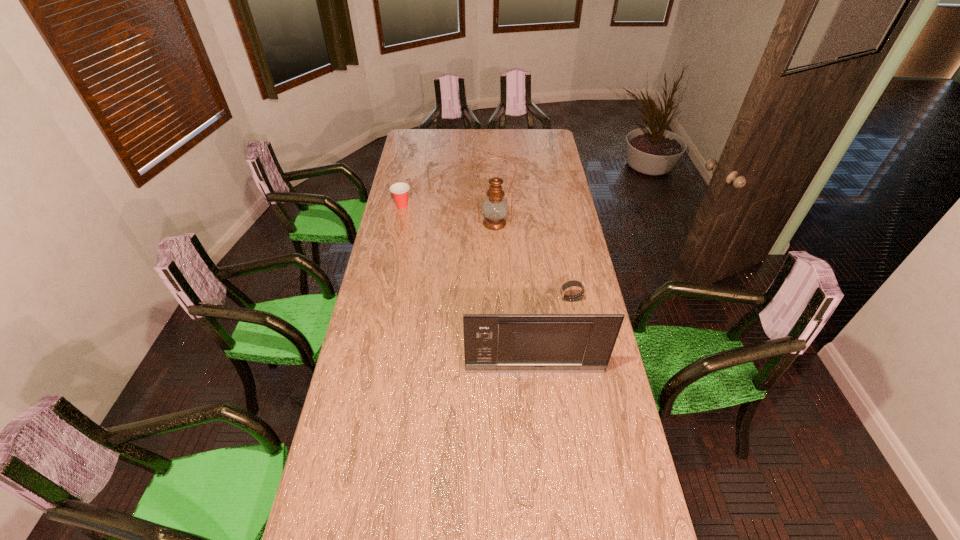
You are a GUI agent. You are given a task and a screenshot of the screen. Output one action in this format:
    pyautogui.click(x=<x>, y=<y>)
    Task: Click on the oil lamp
    Image resolution: width=960 pixels, height=540 pixels.
    Given the screenshot: What is the action you would take?
    pyautogui.click(x=494, y=208)

The height and width of the screenshot is (540, 960). Identify the location of the second tallest object. (493, 343).

This screenshot has width=960, height=540. Find the location of `microwave oven`. microwave oven is located at coordinates (493, 343).

Where is `the farthest object`? This screenshot has height=540, width=960. the farthest object is located at coordinates (399, 190).

Locate an element on the screen. This screenshot has width=960, height=540. the leftmost object is located at coordinates (399, 190).

Image resolution: width=960 pixels, height=540 pixels. Identify the location of the third farthest object. (572, 283).

You are a GUI agent. You are given a task and a screenshot of the screen. Output one action in this format:
    pyautogui.click(x=<x>, y=<y>)
    Task: Click on the free spot located 0.070m on the front of the oil lamp
    The width and height of the screenshot is (960, 540).
    Given the screenshot: What is the action you would take?
    pyautogui.click(x=495, y=241)

At what (x,y) coordinates should I click in order to perform the action: click on free point located 0.090m on the front panel of the nearest object. Please return your answer as a coordinate pair (x, y). The height and width of the screenshot is (540, 960). Looking at the image, I should click on (538, 396).

This screenshot has height=540, width=960. What are the coordinates of `free spot located 0.300m on the right of the farthest object` in the screenshot? It's located at (470, 205).

I want to click on free space located on the face of the watch, so click(x=495, y=299).